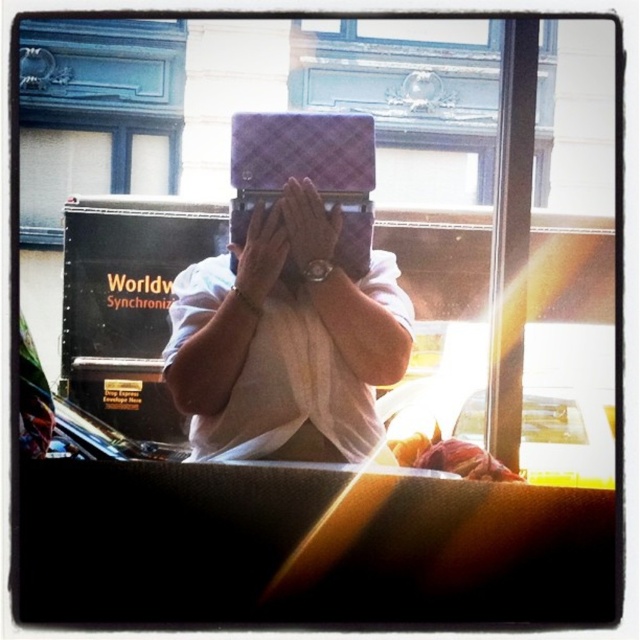
Question: Does matte purple laptop at center have a smaller size compared to matte white hand at center?

Choices:
 (A) no
 (B) yes

Answer: (B)

Question: Which of the following is the farthest from the observer?

Choices:
 (A) (300, 198)
 (B) (250, 250)

Answer: (A)

Question: Does matte purple laptop at center appear under matte white hand at center?

Choices:
 (A) no
 (B) yes

Answer: (A)

Question: Can you confirm if matte purple laptop at center is wider than matte white hand at center?

Choices:
 (A) no
 (B) yes

Answer: (B)